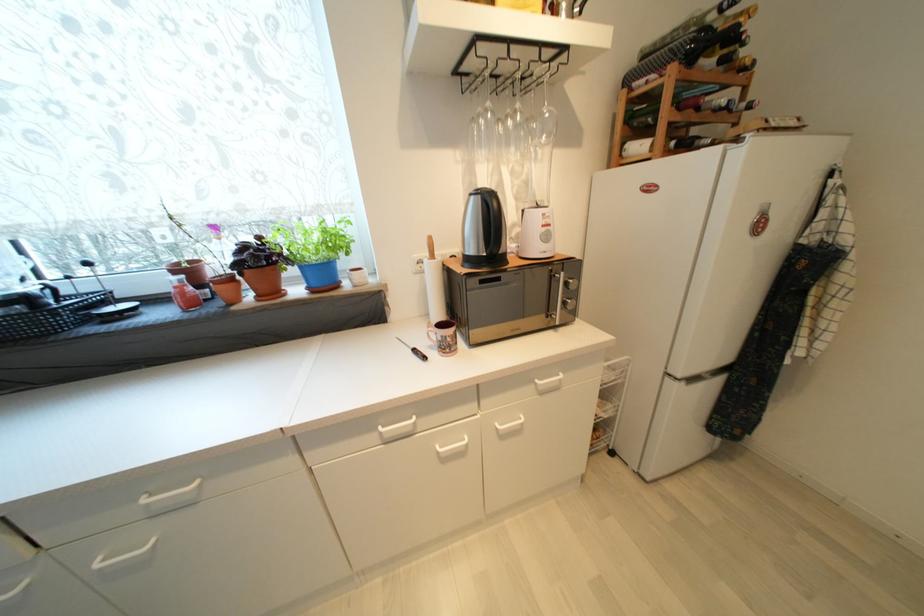
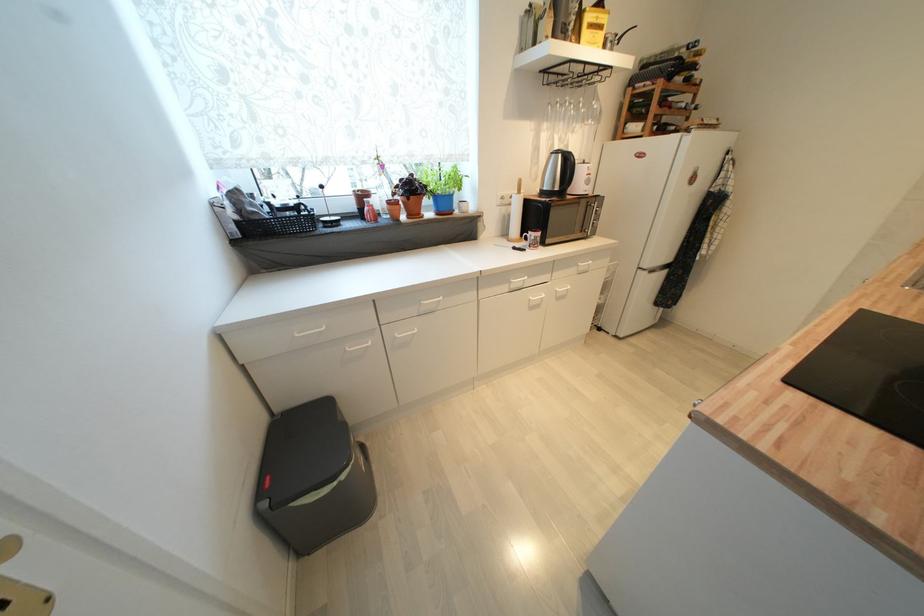
Question: I am providing you with two images of the same scene from different viewpoints. Please identify which objects are invisible in image2.

Choices:
 (A) wine glass
 (B) white cabinet handle
 (C) mug handle
 (D) none of these

Answer: (D)